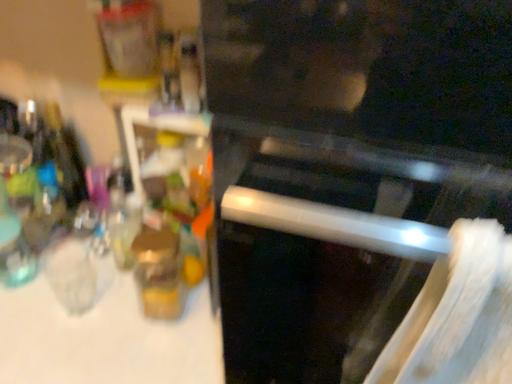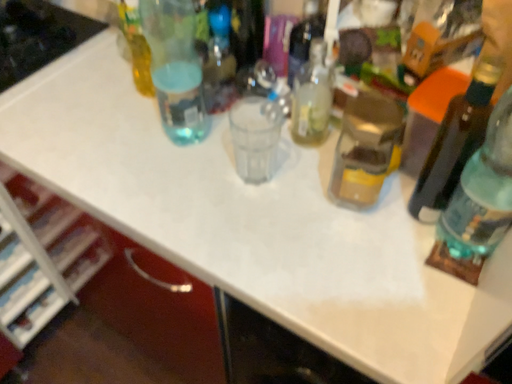
Question: Which way did the camera rotate in the video?

Choices:
 (A) rotated downward
 (B) rotated upward

Answer: (A)